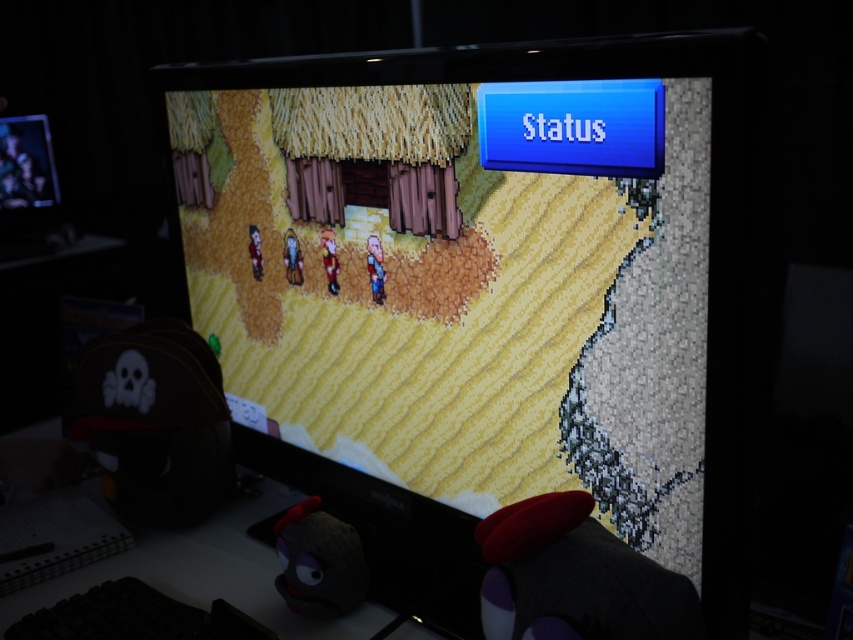
Between matte black monitor at center and matte black monitor at upper left, which one appears on the left side from the viewer's perspective?

Positioned to the left is matte black monitor at upper left.

Is point (496, 376) closer to camera compared to point (18, 150)?

Yes, point (496, 376) is closer to viewer.

I want to click on matte black monitor at center, so click(485, 289).

The image size is (853, 640). What are the coordinates of `matte black monitor at center` in the screenshot? It's located at (485, 289).

Which is in front, point (657, 458) or point (244, 522)?

Point (657, 458)

Can you confirm if matte black monitor at center is wider than white matte desk at lower left?

Yes.

This screenshot has width=853, height=640. I want to click on matte black monitor at center, so click(485, 289).

This screenshot has width=853, height=640. In order to click on matte black monitor at center in this screenshot , I will do `click(485, 289)`.

Which is in front, point (97, 579) or point (57, 202)?

Point (97, 579) is in front.

Is point (27, 428) more distant than point (4, 176)?

No, it is in front of (4, 176).

Where is `white matte desk at lower left`? white matte desk at lower left is located at coordinates (206, 572).

The width and height of the screenshot is (853, 640). Identify the location of white matte desk at lower left. (206, 572).